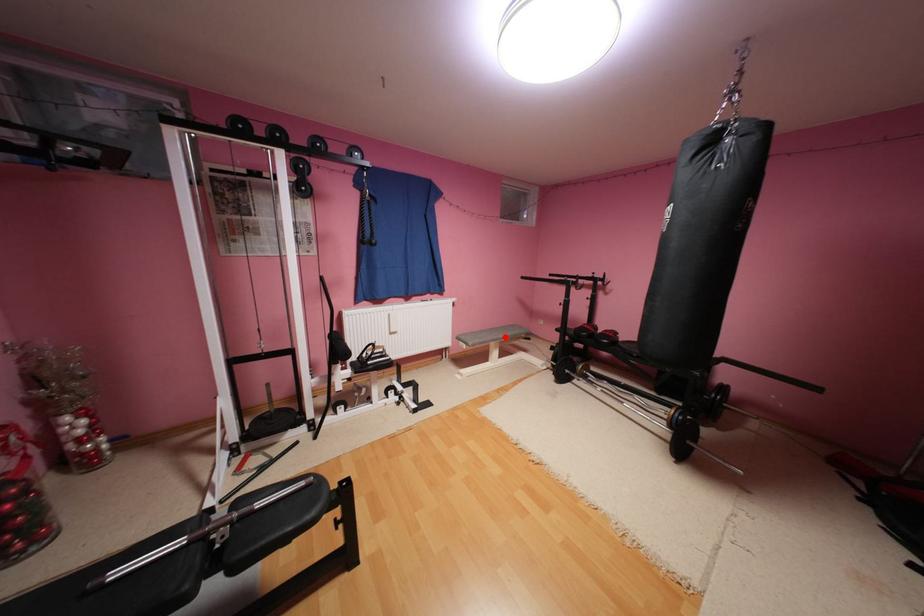
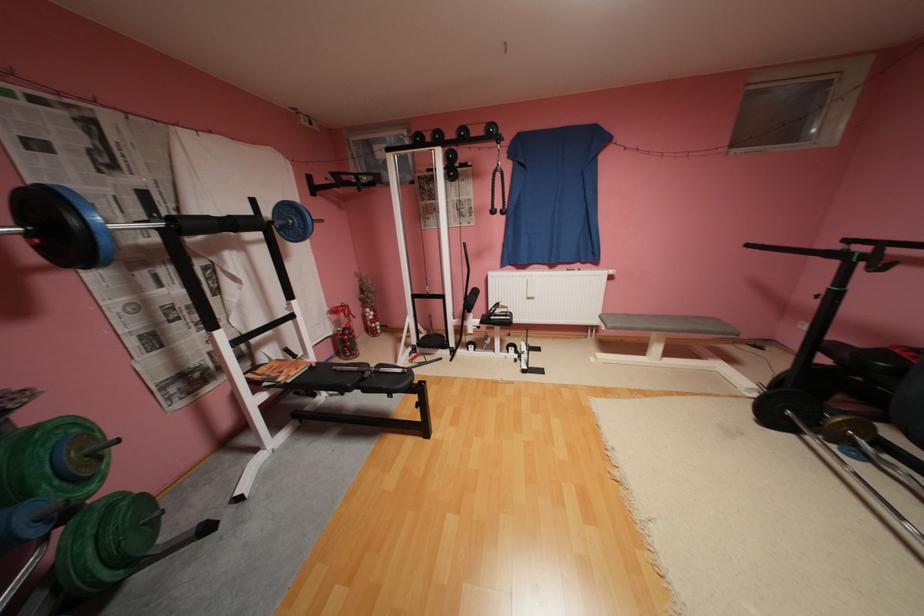
The point at the highlighted location is marked in the first image. Where is the corresponding point in the second image?

(664, 326)